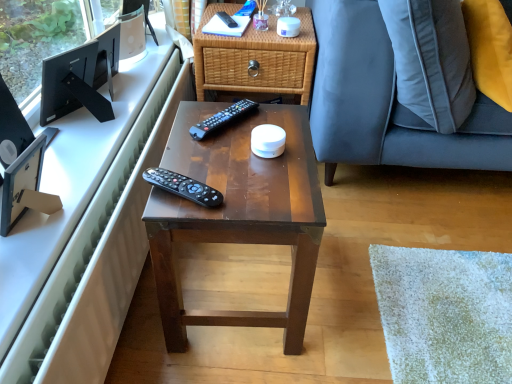
You are a GUI agent. You are given a task and a screenshot of the screen. Output one action in this format:
    pyautogui.click(x=<x>, y=<y>)
    Task: Click on the unoccupied area in front of black plastic picture frame at left, which ranks as the first television in front-to-back order
    
    Given the screenshot: What is the action you would take?
    pyautogui.click(x=32, y=268)